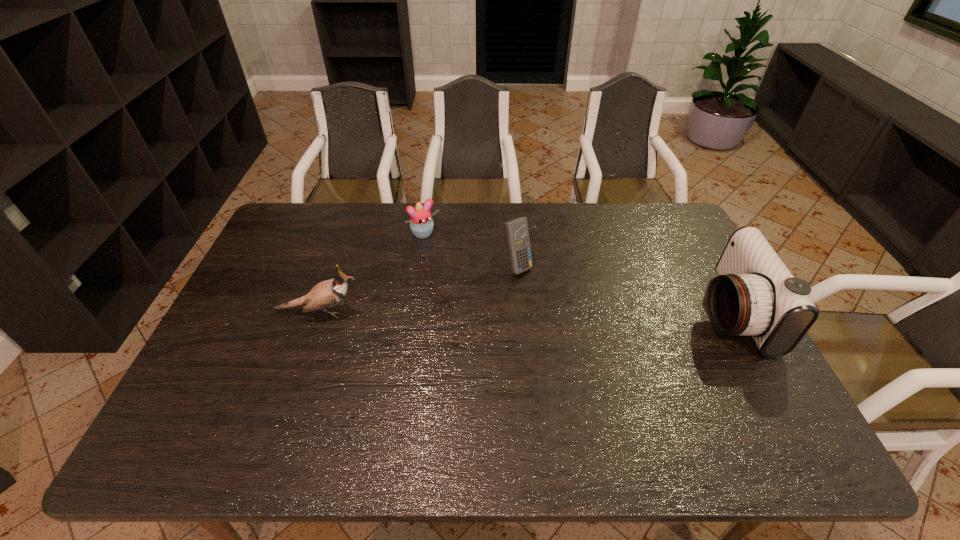
You are a GUI agent. You are given a task and a screenshot of the screen. Output one action in this format:
    pyautogui.click(x=<x>, y=<y>)
    Task: Click on the free spot located on the face of the farthest object
    Image resolution: width=960 pixels, height=540 pixels.
    Given the screenshot: What is the action you would take?
    pyautogui.click(x=484, y=304)

Locate an element on the screen. This screenshot has height=540, width=960. vacant region located 0.100m on the face of the farthest object is located at coordinates (445, 258).

Locate an element on the screen. This screenshot has height=540, width=960. vacant area situated 0.380m on the front-facing side of the second object from right to left is located at coordinates (622, 359).

Locate an element on the screen. The height and width of the screenshot is (540, 960). free space located 0.080m on the front-facing side of the second object from right to left is located at coordinates (544, 292).

What are the coordinates of `vacant space located on the front-facing side of the second object from right to left` in the screenshot? It's located at (540, 288).

Where is `object that is at the far edge`? This screenshot has height=540, width=960. object that is at the far edge is located at coordinates (421, 223).

What are the coordinates of `object that is positioned at the left edge` in the screenshot? It's located at (326, 294).

Locate an element on the screen. This screenshot has width=960, height=540. object present at the right edge is located at coordinates (754, 294).

This screenshot has width=960, height=540. I want to click on free location at the far edge, so click(376, 220).

In the image, there is a desktop. Where is `blank space at the near edge`? This screenshot has width=960, height=540. blank space at the near edge is located at coordinates (276, 406).